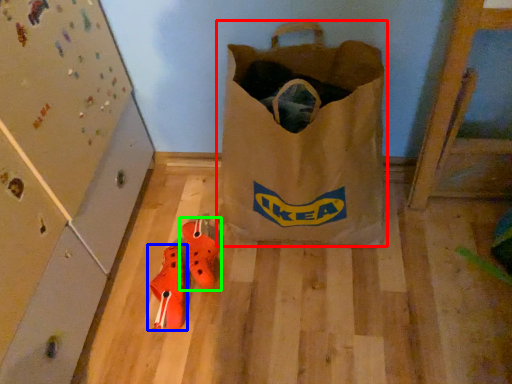
Question: Which object is positioned closest to luggage and bags (highlighted by a red box)? Select from footwear (highlighted by a blue box) and footwear (highlighted by a green box).

Choices:
 (A) footwear
 (B) footwear

Answer: (B)